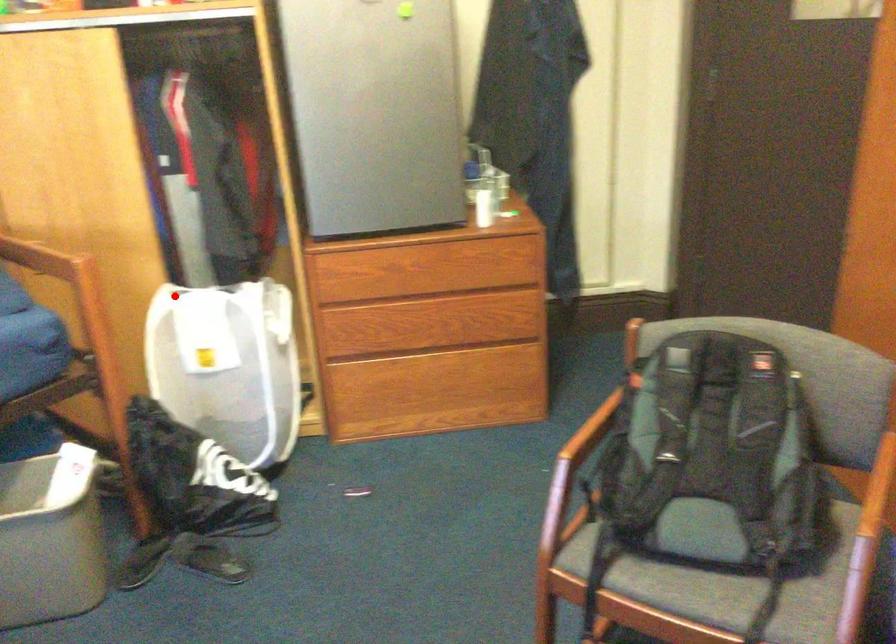
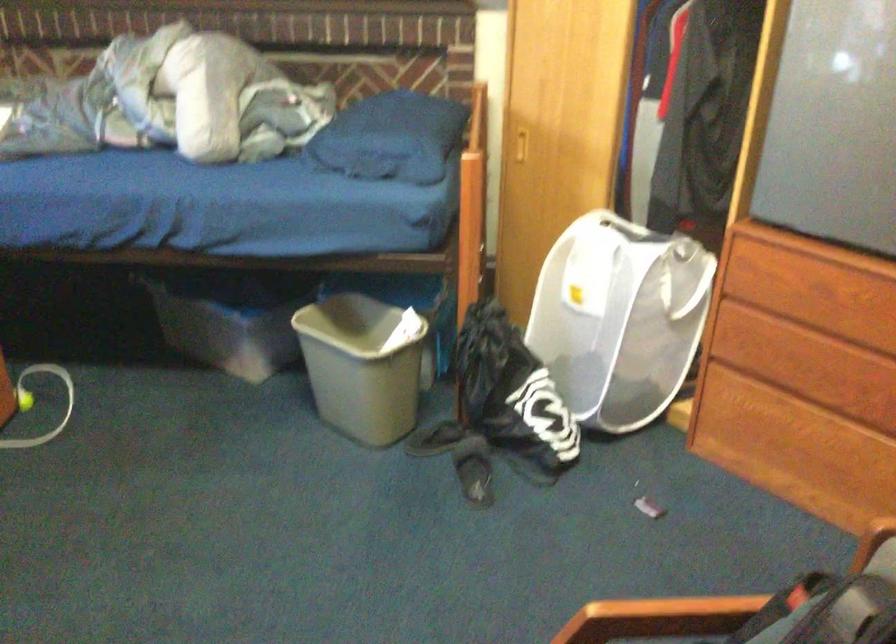
Where in the second image is the point corresponding to the highlighted location from the first image?

(600, 225)